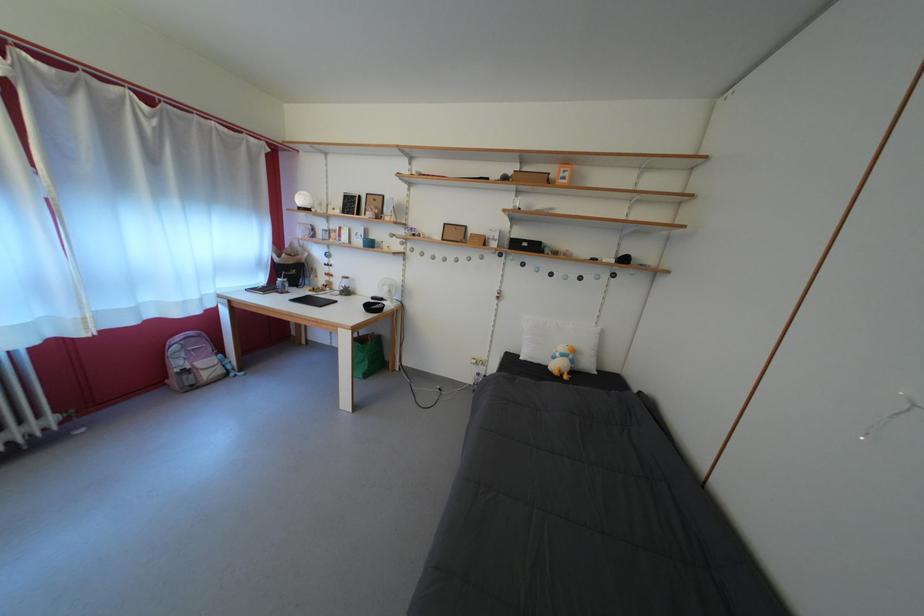
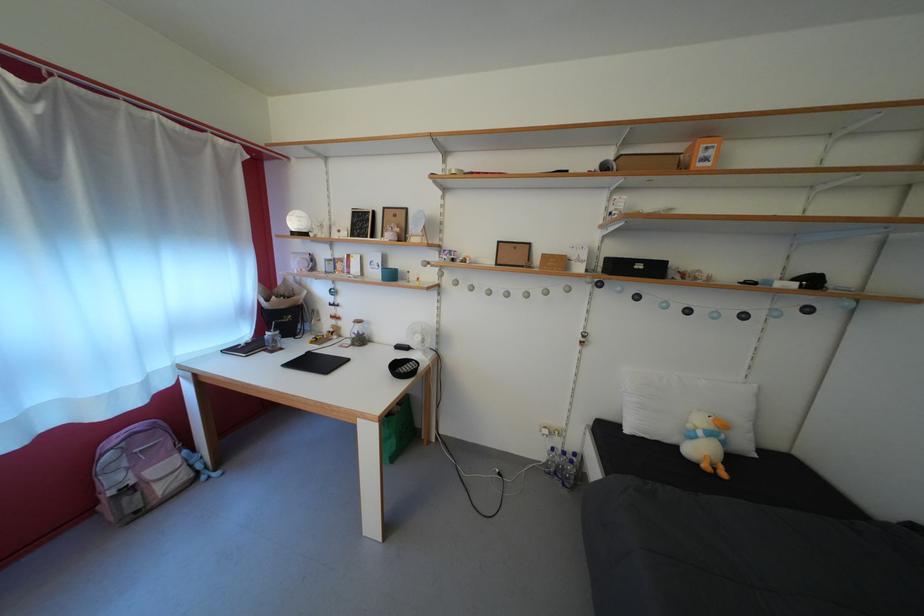
In the second image, find the point that corresponds to [347,290] in the first image.

(358, 334)